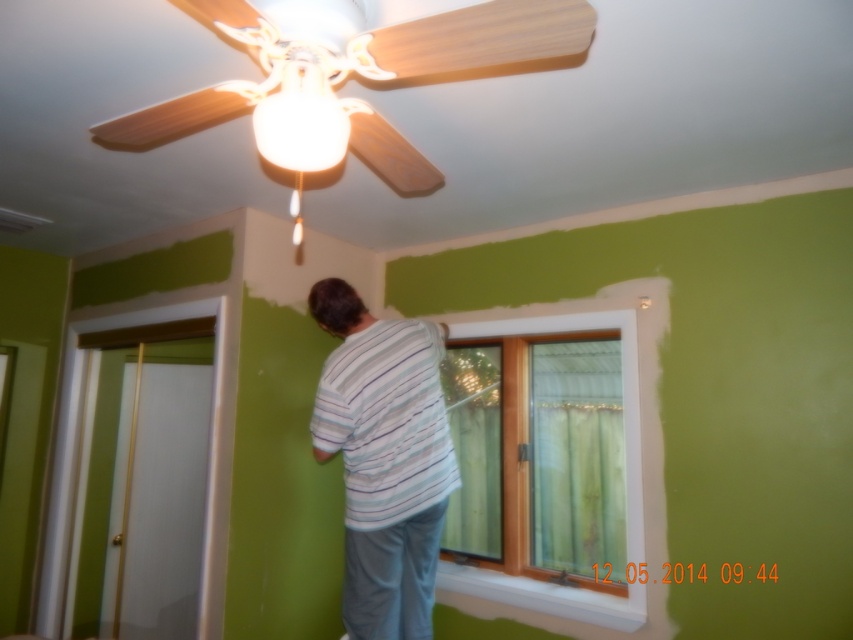
Question: Which of the following is the closest to the observer?

Choices:
 (A) (231, 97)
 (B) (544, 465)
 (C) (415, 426)

Answer: (A)

Question: Based on their relative distances, which object is farther from the wooden ceiling fan at upper center?

Choices:
 (A) green sheer curtain at window
 (B) striped cotton shirt at center
 (C) white wooden window at center

Answer: (A)

Question: Which point appears closest to the camera in this image?

Choices:
 (A) (616, 509)
 (B) (428, 56)

Answer: (B)

Question: Considering the relative positions of striped cotton shirt at center and wooden ceiling fan at upper center in the image provided, where is striped cotton shirt at center located with respect to wooden ceiling fan at upper center?

Choices:
 (A) below
 (B) above

Answer: (A)

Question: Is wooden ceiling fan at upper center positioned in front of green sheer curtain at window?

Choices:
 (A) yes
 (B) no

Answer: (A)

Question: Is wooden ceiling fan at upper center positioned at the back of green sheer curtain at window?

Choices:
 (A) yes
 (B) no

Answer: (B)